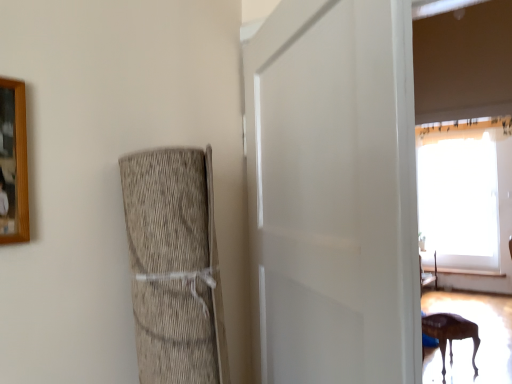
Question: In the image, is wooden picture frame at upper left on the left side or the right side of white matte door at center?

Choices:
 (A) right
 (B) left

Answer: (B)

Question: Considering the positions of wooden picture frame at upper left and white matte door at center in the image, is wooden picture frame at upper left wider or thinner than white matte door at center?

Choices:
 (A) wide
 (B) thin

Answer: (B)

Question: Which is farther from the wooden table at lower right?

Choices:
 (A) wooden picture frame at upper left
 (B) white matte door at center

Answer: (A)

Question: Which of these objects is positioned closest to the wooden picture frame at upper left?

Choices:
 (A) wooden table at lower right
 (B) white matte door at center

Answer: (B)